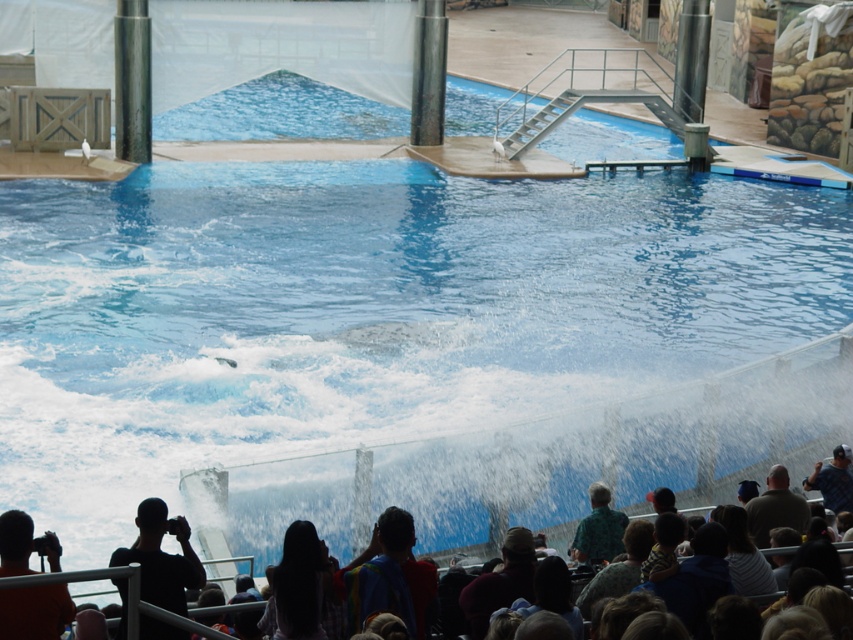
Who is positioned more to the right, brown fabric hat at lower center or dark brown leather jacket at lower right?

Positioned to the right is dark brown leather jacket at lower right.

Can you confirm if brown fabric hat at lower center is taller than dark brown leather jacket at lower right?

Yes, brown fabric hat at lower center is taller than dark brown leather jacket at lower right.

Who is more forward, (515, 544) or (780, 516)?

Positioned in front is point (515, 544).

The width and height of the screenshot is (853, 640). In order to click on brown fabric hat at lower center in this screenshot , I will do `click(500, 580)`.

Does orange shirt at lower left appear over blue fabric cap at lower right?

No.

Who is positioned more to the right, orange shirt at lower left or blue fabric cap at lower right?

From the viewer's perspective, blue fabric cap at lower right appears more on the right side.

Is point (7, 632) in front of point (833, 456)?

Yes, point (7, 632) is in front of point (833, 456).

Identify the location of orange shirt at lower left. The width and height of the screenshot is (853, 640). (33, 611).

Between brown fabric hat at lower center and blue fabric cap at lower right, which one appears on the left side from the viewer's perspective?

brown fabric hat at lower center is more to the left.

Who is shorter, brown fabric hat at lower center or blue fabric cap at lower right?

Standing shorter between the two is blue fabric cap at lower right.

Measure the distance between brown fabric hat at lower center and camera.

brown fabric hat at lower center is 68.54 feet away from camera.

What are the coordinates of `brown fabric hat at lower center` in the screenshot? It's located at (500, 580).